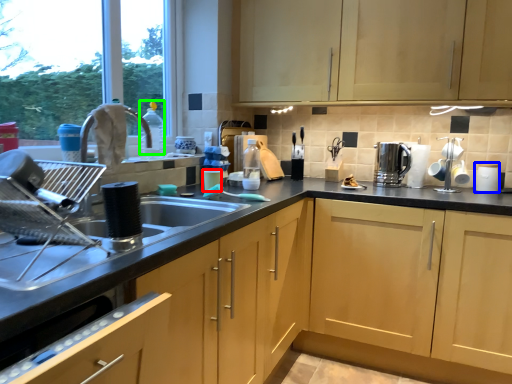
Question: Which is farther away from appliance (highlighted by a red box)? appliance (highlighted by a blue box) or bottle (highlighted by a green box)?

Choices:
 (A) appliance
 (B) bottle

Answer: (A)